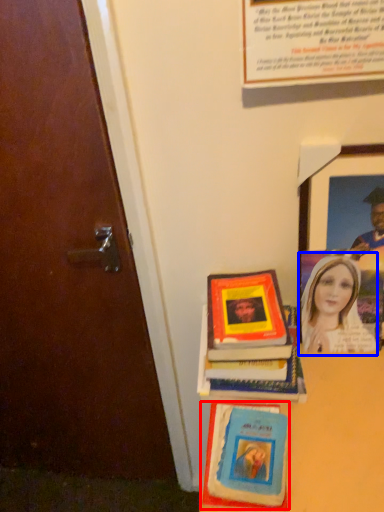
Question: Which object appears farthest to the camera in this image, book cover (highlighted by a red box) or woman (highlighted by a blue box)?

Choices:
 (A) book cover
 (B) woman

Answer: (B)